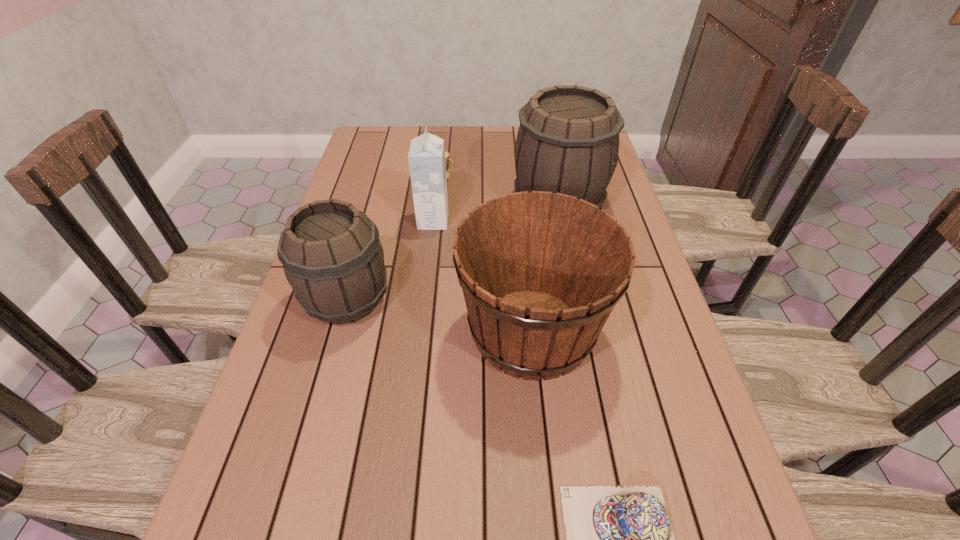
Where is `the tallest wine bucket`? the tallest wine bucket is located at coordinates (568, 140).

You are a GUI agent. You are given a task and a screenshot of the screen. Output one action in this format:
    pyautogui.click(x=<x>, y=<y>)
    Task: Click on the carton
    
    Given the screenshot: What is the action you would take?
    pyautogui.click(x=426, y=157)

Where is `the leftmost object`? The width and height of the screenshot is (960, 540). the leftmost object is located at coordinates tap(332, 257).

Identify the location of candle. (446, 153).

The width and height of the screenshot is (960, 540). What are the coordinates of `free location located 0.270m on the back of the tallest wine bucket` in the screenshot? It's located at (544, 135).

Where is `vacant space situated on the front label of the carton`? vacant space situated on the front label of the carton is located at coordinates (511, 221).

Where is `vacant space located 0.300m on the right of the leftmost object`? vacant space located 0.300m on the right of the leftmost object is located at coordinates (518, 300).

You are a GUI agent. You are given a task and a screenshot of the screen. Output one action in this format:
    pyautogui.click(x=<x>, y=<y>)
    Task: Click on the free spot located 0.080m on the front of the second shortest object
    This screenshot has width=960, height=540.
    Given the screenshot: What is the action you would take?
    pyautogui.click(x=443, y=194)

Locate an element on the screen. This screenshot has width=960, height=540. object at the left edge is located at coordinates (332, 257).

I want to click on vacant space at the far edge of the desktop, so click(x=476, y=134).